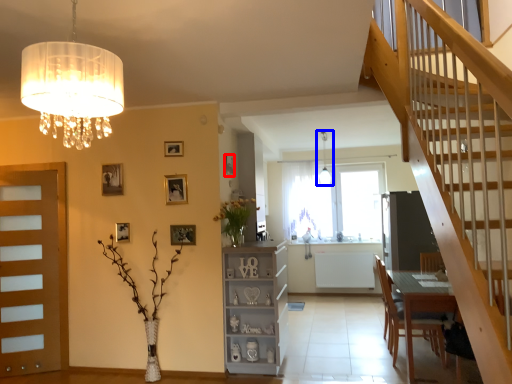
Question: Which of the following is the closest to the observer, picture frame (highlighted by a red box) or light fixture (highlighted by a blue box)?

Choices:
 (A) picture frame
 (B) light fixture

Answer: (A)